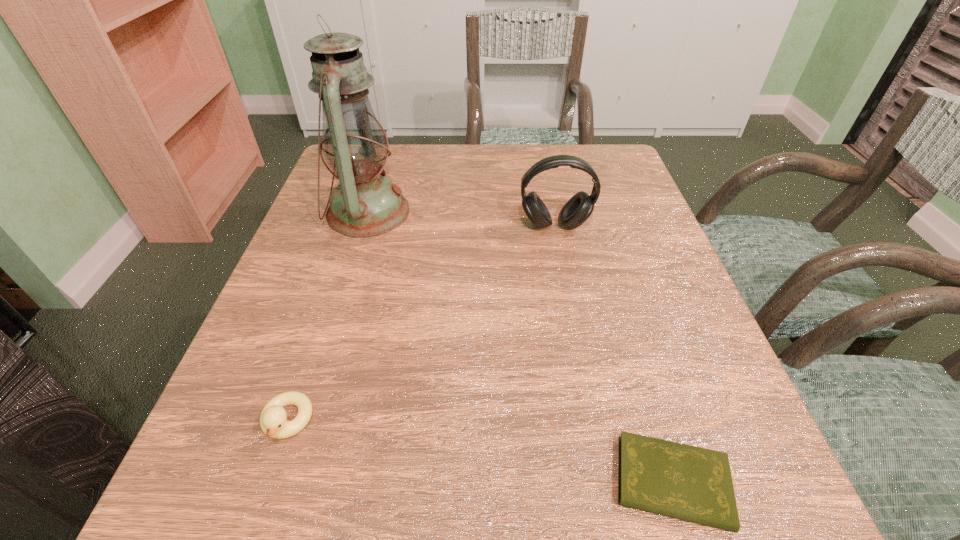
Where is `oil lamp at the left edge`? This screenshot has width=960, height=540. oil lamp at the left edge is located at coordinates (355, 146).

In order to click on duckling located in the left edge section of the desktop in this screenshot , I will do `click(273, 423)`.

Identify the location of headset present at the right edge. (578, 208).

Identify the location of diary that is at the right edge. This screenshot has height=540, width=960. (694, 484).

Where is `object that is at the far left corner`? The width and height of the screenshot is (960, 540). object that is at the far left corner is located at coordinates (355, 146).

In order to click on object located in the near right corner section of the desktop in this screenshot , I will do `click(694, 484)`.

I want to click on vacant space at the far edge of the desktop, so click(x=433, y=158).

Locate an element on the screen. Image resolution: width=960 pixels, height=540 pixels. free space at the near edge of the desktop is located at coordinates (613, 463).

This screenshot has height=540, width=960. In the image, there is a desktop. What are the coordinates of `vacant space at the left edge` in the screenshot? It's located at (325, 272).

Find the location of `vacant space at the right edge of the desktop`. vacant space at the right edge of the desktop is located at coordinates (740, 418).